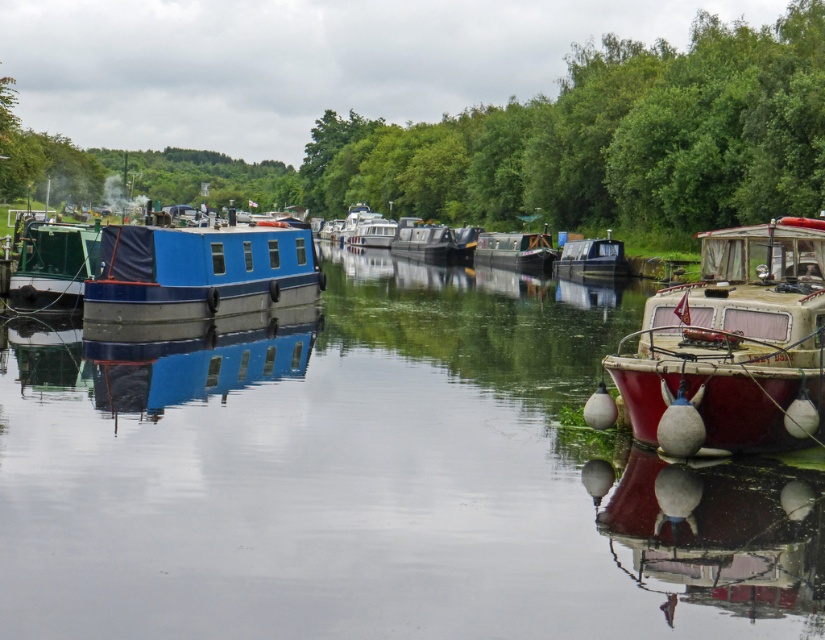
What is the 2D coordinate of the metallic gray cabin cruiser at center?

The metallic gray cabin cruiser at center is located at the 2D coordinate point of (x=592, y=259).

You are a tour guide leading a group along the canal path. You want to inform your group about the distance between the rustic wood boat at right and the metallic gray cabin cruiser at center. How far apart are they?

The rustic wood boat at right is 165.84 feet away from the metallic gray cabin cruiser at center.

You are a photographer positioned on the left bank of the canal. You want to capture both the metallic gray cabin cruiser at center and the blue painted wooden boat at center in a single shot. Which boat should you aim your camera towards first to ensure both are in frame?

You should aim your camera towards the blue painted wooden boat at center first since the metallic gray cabin cruiser at center is to the right of it, ensuring both are included in the frame.